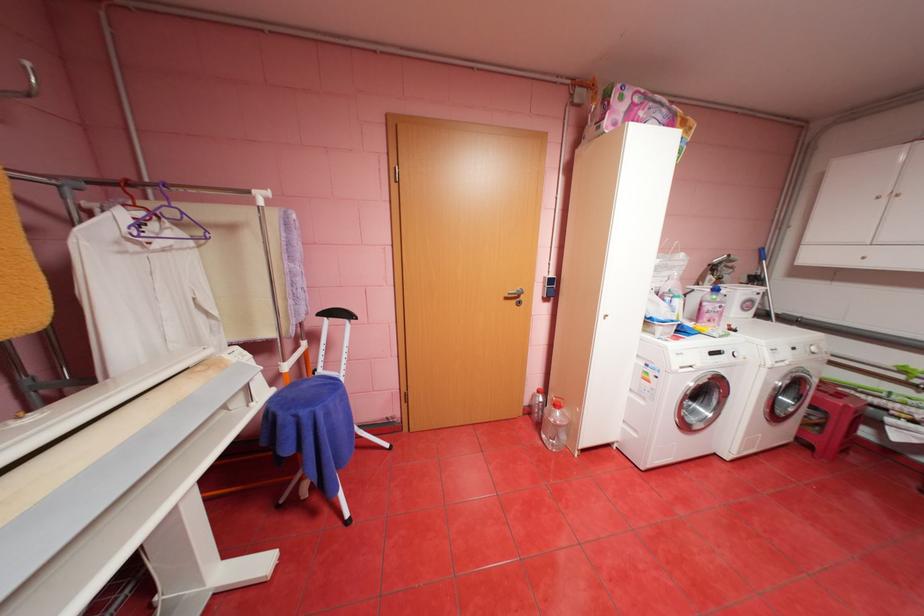
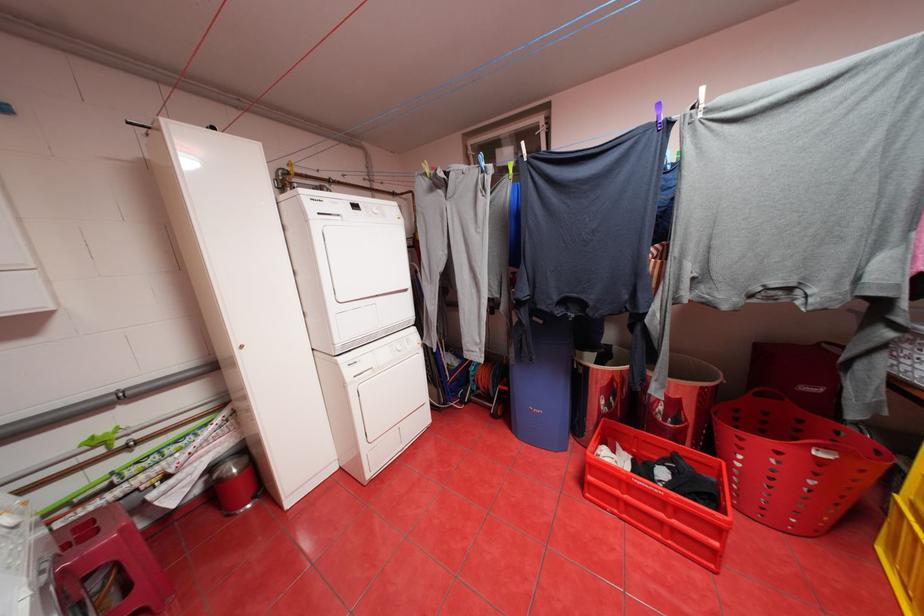
The point at (855, 406) is marked in the first image. Where is the corresponding point in the second image?

(130, 530)